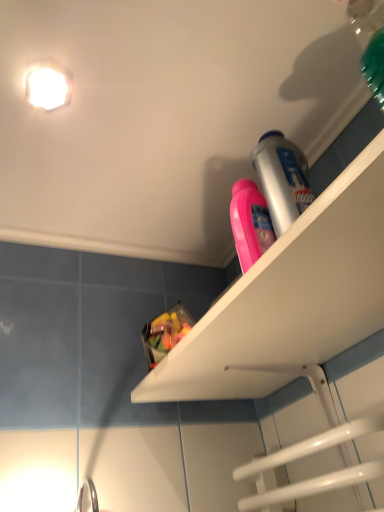
Question: Is translucent plastic bag of candy at upper center inside or outside of white glossy light fixture at upper left?

Choices:
 (A) inside
 (B) outside

Answer: (B)

Question: Is translucent plastic bag of candy at upper center wider or thinner than white glossy light fixture at upper left?

Choices:
 (A) wide
 (B) thin

Answer: (A)

Question: Estimate the real-world distances between objects in this image. Which object is closer to the white plastic shelf at upper right?

Choices:
 (A) white glossy light fixture at upper left
 (B) translucent plastic bag of candy at upper center

Answer: (B)

Question: Which of these objects is positioned farthest from the translucent plastic bag of candy at upper center?

Choices:
 (A) white glossy light fixture at upper left
 (B) white plastic shelf at upper right

Answer: (A)